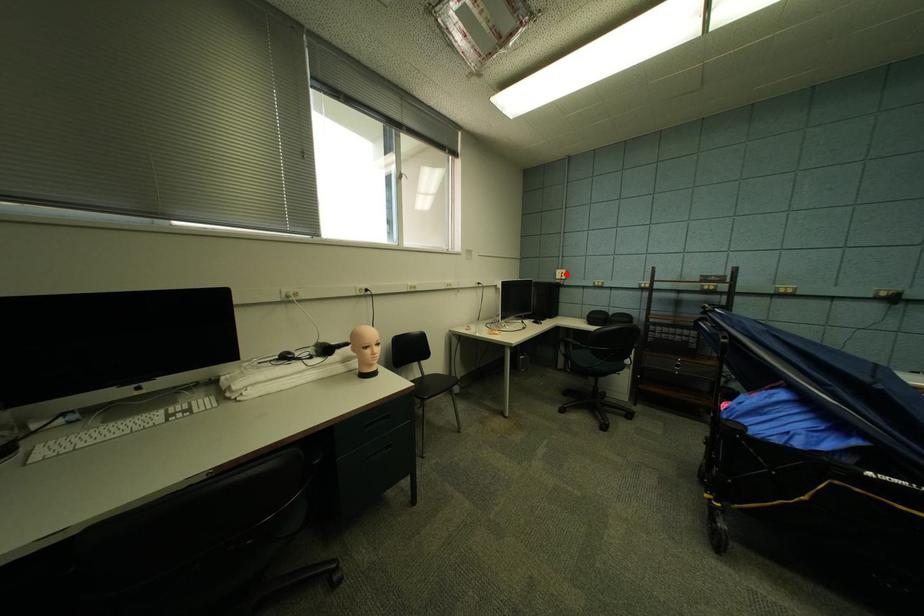
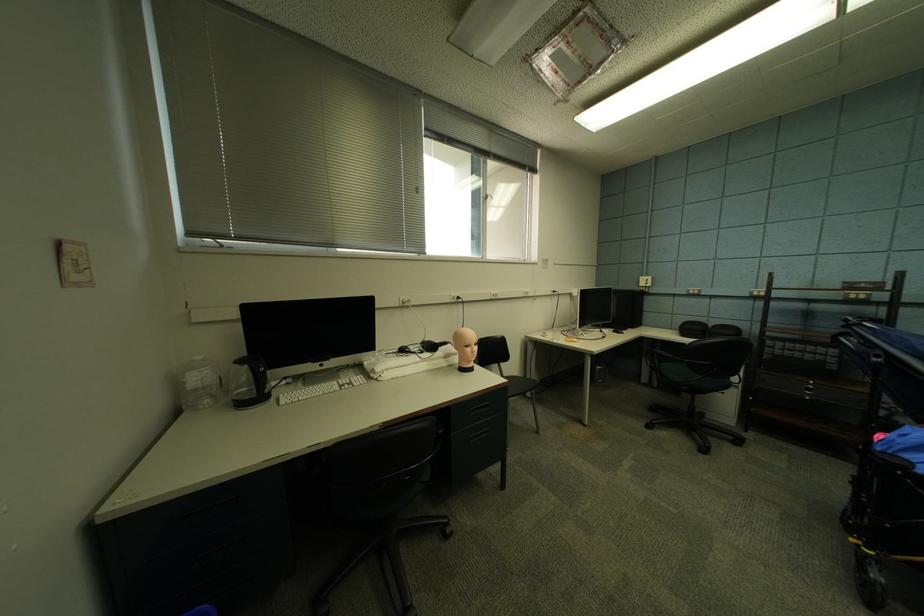
Find the pixel in the second image that matches the highlighted location in the first image.

(650, 282)